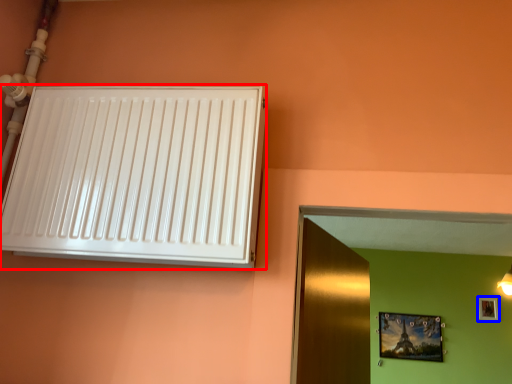
Question: Which of the following is the closest to the observer, air conditioning (highlighted by a red box) or picture frame (highlighted by a blue box)?

Choices:
 (A) air conditioning
 (B) picture frame

Answer: (A)